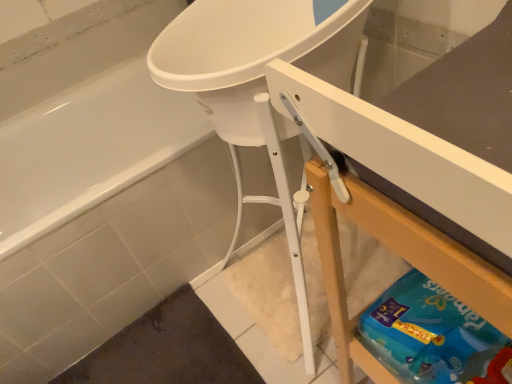
What do you see at coordinates (100, 193) in the screenshot?
I see `white glossy bathtub at upper left` at bounding box center [100, 193].

You are a GUI agent. You are given a task and a screenshot of the screen. Output one action in this format:
    pyautogui.click(x=<x>, y=<y>)
    Task: Click on the white glossy bathtub at upper left
    The image size is (512, 384).
    Given the screenshot: What is the action you would take?
    pyautogui.click(x=100, y=193)

The width and height of the screenshot is (512, 384). I want to click on blue cardboard box at lower right, so click(x=401, y=257).

What do you see at coordinates (401, 257) in the screenshot?
I see `blue cardboard box at lower right` at bounding box center [401, 257].

Locate an element on the screen. white glossy bathtub at upper left is located at coordinates (100, 193).

In the image, is blue cardboard box at lower right on the left side or the right side of white glossy bathtub at upper left?

blue cardboard box at lower right is positioned on white glossy bathtub at upper left's right side.

Consider the image. Which is in front, blue cardboard box at lower right or white glossy bathtub at upper left?

blue cardboard box at lower right is closer to the camera.

Which point is more forward, (344, 374) or (191, 172)?

The point (344, 374) is closer.

From the image's perspective, which one is positioned higher, blue cardboard box at lower right or white glossy bathtub at upper left?

white glossy bathtub at upper left.

From a real-world perspective, between blue cardboard box at lower right and white glossy bathtub at upper left, who is vertically lower?

In real-world perspective, white glossy bathtub at upper left is lower.

Can you confirm if blue cardboard box at lower right is thinner than white glossy bathtub at upper left?

Yes, blue cardboard box at lower right is thinner than white glossy bathtub at upper left.

Between blue cardboard box at lower right and white glossy bathtub at upper left, which one has less height?

With less height is blue cardboard box at lower right.

Which of these two, blue cardboard box at lower right or white glossy bathtub at upper left, is smaller?

blue cardboard box at lower right is smaller.

Is white glossy bathtub at upper left a part of blue cardboard box at lower right?

That's incorrect, white glossy bathtub at upper left is not inside blue cardboard box at lower right.

Is blue cardboard box at lower right placed right next to white glossy bathtub at upper left?

There is a gap between blue cardboard box at lower right and white glossy bathtub at upper left.

Is blue cardboard box at lower right turned away from white glossy bathtub at upper left?

No, white glossy bathtub at upper left is not at the back of blue cardboard box at lower right.

This screenshot has width=512, height=384. Find the location of `counter to the right of white glossy bathtub at upper left`. counter to the right of white glossy bathtub at upper left is located at coordinates (401, 257).

Which object is positioned more to the right, white glossy bathtub at upper left or blue cardboard box at lower right?

blue cardboard box at lower right is more to the right.

Is the depth of white glossy bathtub at upper left greater than that of blue cardboard box at lower right?

Yes, white glossy bathtub at upper left is behind blue cardboard box at lower right.

Is point (133, 87) positioned after point (473, 255)?

Yes, point (133, 87) is behind point (473, 255).

From the image's perspective, is white glossy bathtub at upper left above blue cardboard box at lower right?

Yes, from the image's perspective, white glossy bathtub at upper left is above blue cardboard box at lower right.

From a real-world perspective, is white glossy bathtub at upper left positioned above or below blue cardboard box at lower right?

Clearly, from a real-world perspective, white glossy bathtub at upper left is below blue cardboard box at lower right.

Between white glossy bathtub at upper left and blue cardboard box at lower right, which one has larger width?

Wider between the two is white glossy bathtub at upper left.

Does white glossy bathtub at upper left have a greater height compared to blue cardboard box at lower right?

Correct, white glossy bathtub at upper left is much taller as blue cardboard box at lower right.

Between white glossy bathtub at upper left and blue cardboard box at lower right, which one has smaller size?

blue cardboard box at lower right is smaller.

Is white glossy bathtub at upper left inside the boundaries of blue cardboard box at lower right, or outside?

white glossy bathtub at upper left exists outside the volume of blue cardboard box at lower right.

Is white glossy bathtub at upper left placed right next to blue cardboard box at lower right?

No, white glossy bathtub at upper left is not beside blue cardboard box at lower right.

Is white glossy bathtub at upper left facing away from blue cardboard box at lower right?

No, white glossy bathtub at upper left is not facing the opposite direction of blue cardboard box at lower right.

What are the coordinates of `bathtub on the left side of blue cardboard box at lower right` in the screenshot? It's located at (100, 193).

The image size is (512, 384). In order to click on counter that is above the white glossy bathtub at upper left (from a real-world perspective) in this screenshot , I will do coord(401,257).

Identify the location of bathtub located on the left of blue cardboard box at lower right. The height and width of the screenshot is (384, 512). (100, 193).